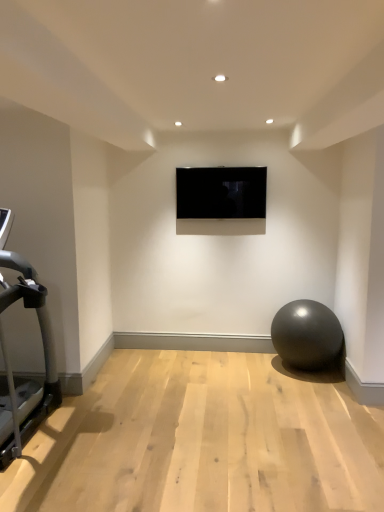
Describe the element at coordinates (307, 335) in the screenshot. I see `glossy rubber ball at lower right` at that location.

You are a GUI agent. You are given a task and a screenshot of the screen. Output one action in this format:
    pyautogui.click(x=<x>, y=<y>)
    Task: Click on the silver metallic treadmill at left
    
    Given the screenshot: What is the action you would take?
    pyautogui.click(x=43, y=348)

Locate an element on the screen. This screenshot has height=512, width=384. black glossy tv at center is located at coordinates (221, 193).

Where is `glossy rubber ball at lower right`? The height and width of the screenshot is (512, 384). glossy rubber ball at lower right is located at coordinates click(x=307, y=335).

Is silver metallic treadmill at left not close to glossy rubber ball at lower right?

silver metallic treadmill at left is positioned a significant distance from glossy rubber ball at lower right.

From the picture: From a real-world perspective, is silver metallic treadmill at left located beneath glossy rubber ball at lower right?

Incorrect, from a real-world perspective, silver metallic treadmill at left is higher than glossy rubber ball at lower right.

From the image's perspective, is silver metallic treadmill at left positioned above or below glossy rubber ball at lower right?

From the image's perspective, silver metallic treadmill at left appears above glossy rubber ball at lower right.

The image size is (384, 512). I want to click on ball below the silver metallic treadmill at left (from a real-world perspective), so [x=307, y=335].

Which of these two, glossy rubber ball at lower right or black glossy tv at center, is wider?

glossy rubber ball at lower right.

Is point (290, 326) positioned behind point (225, 217)?

That is False.

In the image, is glossy rubber ball at lower right on the left side or the right side of black glossy tv at center?

From the image, it's evident that glossy rubber ball at lower right is to the right of black glossy tv at center.

From the image's perspective, between glossy rubber ball at lower right and silver metallic treadmill at left, which one is located above?

silver metallic treadmill at left.

Considering the relative positions of glossy rubber ball at lower right and silver metallic treadmill at left in the image provided, is glossy rubber ball at lower right to the right of silver metallic treadmill at left from the viewer's perspective?

Yes.

From a real-world perspective, is glossy rubber ball at lower right under silver metallic treadmill at left?

Yes.

Looking at the image, does glossy rubber ball at lower right seem bigger or smaller compared to silver metallic treadmill at left?

In the image, glossy rubber ball at lower right appears to be smaller than silver metallic treadmill at left.

The height and width of the screenshot is (512, 384). I want to click on treadmill below the black glossy tv at center (from a real-world perspective), so pos(43,348).

Does point (252, 202) appear closer or farther from the camera than point (6, 362)?

Clearly, point (252, 202) is more distant from the camera than point (6, 362).

Is black glossy tv at center turned away from silver metallic treadmill at left?

No, black glossy tv at center is not facing away from silver metallic treadmill at left.

From the image's perspective, is black glossy tv at center above or below glossy rubber ball at lower right?

black glossy tv at center is above glossy rubber ball at lower right.

Which of these two, black glossy tv at center or glossy rubber ball at lower right, is wider?

→ glossy rubber ball at lower right.

Is point (216, 205) closer or farther from the camera than point (285, 311)?

Point (216, 205) appears to be farther away from the viewer than point (285, 311).

Identify the location of television above the glossy rubber ball at lower right (from a real-world perspective). The image size is (384, 512). (221, 193).

From a real-world perspective, is silver metallic treadmill at left positioned over black glossy tv at center based on gravity?

No, from a real-world perspective, silver metallic treadmill at left is not on top of black glossy tv at center.

Considering the points (53, 395) and (259, 197), which point is in front, point (53, 395) or point (259, 197)?

The point (53, 395) is closer to the camera.

From the image's perspective, which one is positioned lower, silver metallic treadmill at left or black glossy tv at center?

silver metallic treadmill at left.

Find the location of a particular element. Image resolution: width=384 pixels, height=512 pixels. ball that is below the silver metallic treadmill at left (from the image's perspective) is located at coordinates (307, 335).

Image resolution: width=384 pixels, height=512 pixels. I want to click on television behind the glossy rubber ball at lower right, so click(221, 193).

Estimate the real-world distances between objects in this image. Which object is further from glossy rubber ball at lower right, silver metallic treadmill at left or black glossy tv at center?

Based on the image, silver metallic treadmill at left appears to be further to glossy rubber ball at lower right.

In the scene shown: Looking at the image, which one is located closer to silver metallic treadmill at left, glossy rubber ball at lower right or black glossy tv at center?

Based on the image, black glossy tv at center appears to be nearer to silver metallic treadmill at left.

From the image, which object appears to be nearer to glossy rubber ball at lower right, black glossy tv at center or silver metallic treadmill at left?

black glossy tv at center.

When comparing their distances from black glossy tv at center, does glossy rubber ball at lower right or silver metallic treadmill at left seem further?

silver metallic treadmill at left.

When comparing their distances from black glossy tv at center, does silver metallic treadmill at left or glossy rubber ball at lower right seem further?

silver metallic treadmill at left is further to black glossy tv at center.

When comparing their distances from silver metallic treadmill at left, does black glossy tv at center or glossy rubber ball at lower right seem further?

The object further to silver metallic treadmill at left is glossy rubber ball at lower right.

Where is `television between silver metallic treadmill at left and glossy rubber ball at lower right from left to right`? This screenshot has height=512, width=384. television between silver metallic treadmill at left and glossy rubber ball at lower right from left to right is located at coordinates (221, 193).